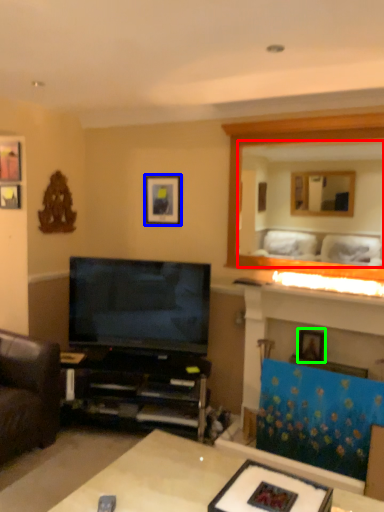
Question: Estimate the real-world distances between objects in this image. Which object is farther from mirror (highlighted by a red box), picture frame (highlighted by a blue box) or picture frame (highlighted by a green box)?

Choices:
 (A) picture frame
 (B) picture frame

Answer: (B)